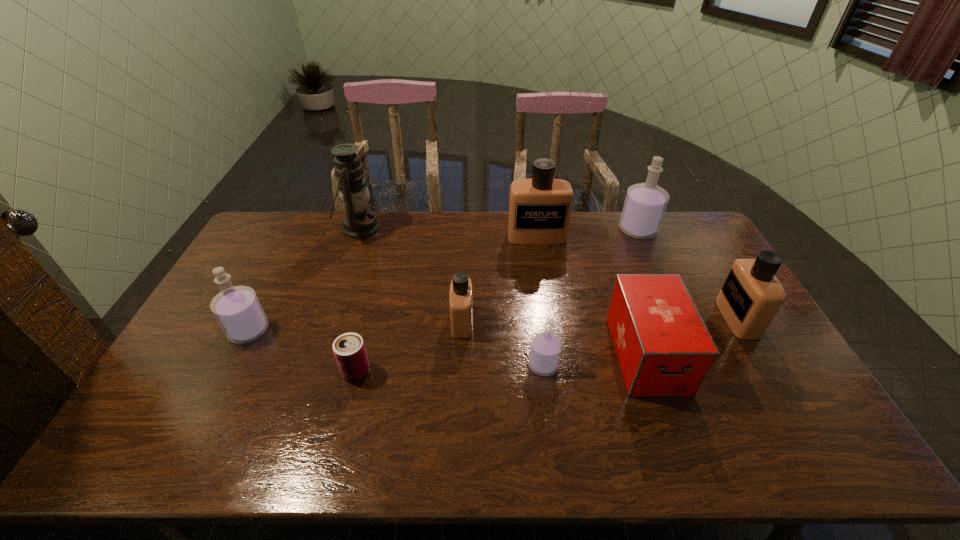
What are the coordinates of `object present at the right edge` in the screenshot? It's located at (751, 295).

Identify the location of free space at the far edge of the desktop. The image size is (960, 540). (515, 246).

This screenshot has height=540, width=960. In the image, there is a desktop. In order to click on free space at the near edge in this screenshot , I will do `click(203, 440)`.

You are a GUI agent. You are given a task and a screenshot of the screen. Output one action in this format:
    pyautogui.click(x=<x>, y=<y>)
    Task: Click on the free space at the left edge of the desktop
    This screenshot has width=960, height=540.
    Given the screenshot: What is the action you would take?
    pyautogui.click(x=228, y=360)

The width and height of the screenshot is (960, 540). What are the coordinates of `vacant region at the right edge of the desktop` in the screenshot? It's located at (724, 350).

I want to click on unoccupied position between the second perfume from left to right and the biggest beige perfume, so pyautogui.click(x=499, y=279).

You are a GUI agent. You are given a task and a screenshot of the screen. Output one action in this format:
    pyautogui.click(x=<x>, y=<y>)
    Task: Click on the unoccupied area between the pink can and the leftmost purple perfume
    The width and height of the screenshot is (960, 540).
    Given the screenshot: What is the action you would take?
    pyautogui.click(x=302, y=351)

The image size is (960, 540). Find the location of `vacant point located between the rightmost beige perfume and the leftmost object`. vacant point located between the rightmost beige perfume and the leftmost object is located at coordinates (493, 325).

Identify the location of free space between the shortest object and the leftmost object. This screenshot has width=960, height=540. (302, 351).

At what (x,y) coordinates should I click in order to perform the action: click on free spot between the second beige perfume from right to left and the nearest purple perfume. Please return your answer as a coordinate pair (x, y). The height and width of the screenshot is (540, 960). Looking at the image, I should click on (540, 301).